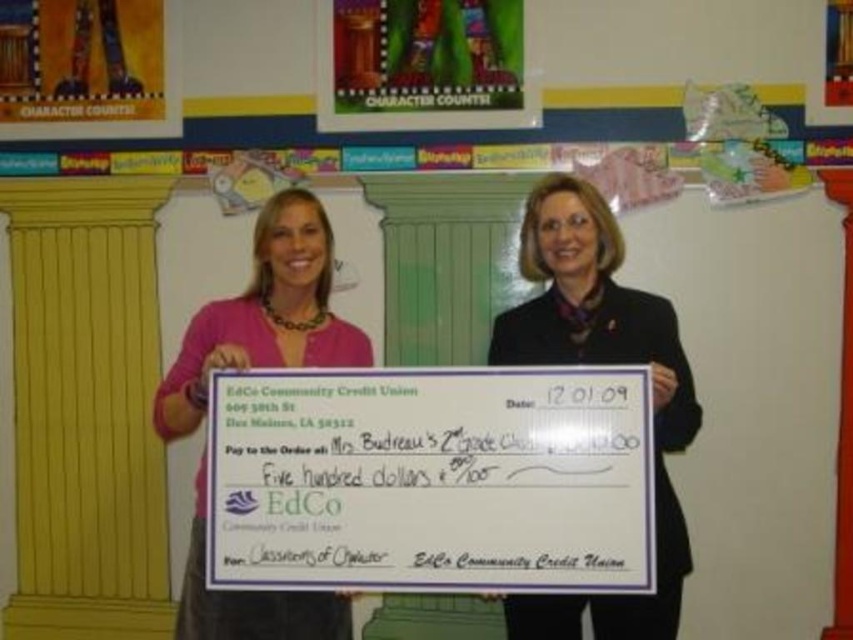
What do you see at coordinates (599, 362) in the screenshot?
I see `black fabric coat at center` at bounding box center [599, 362].

Who is higher up, black fabric coat at center or pink fabric shirt at center?

pink fabric shirt at center is above.

Between point (544, 609) and point (312, 248), which one is positioned behind?

The point (544, 609) is behind.

Where is `black fabric coat at center`? This screenshot has height=640, width=853. black fabric coat at center is located at coordinates (599, 362).